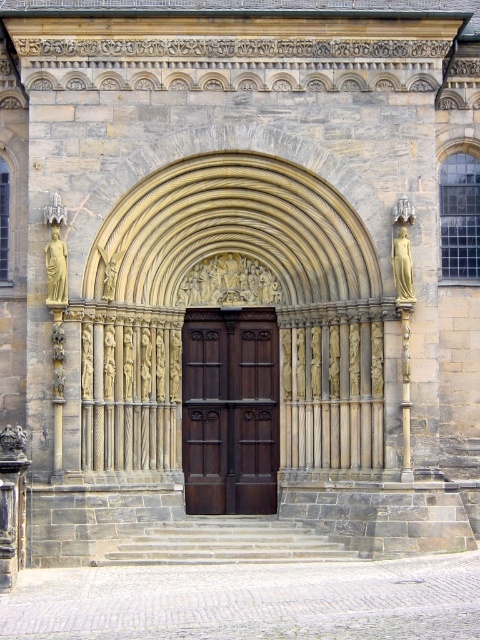
Question: Which point is closer to the camera taking this photo?

Choices:
 (A) (104, 275)
 (B) (191, 394)

Answer: (A)

Question: Is dark wood door at center to the right of golden stone statue at right from the viewer's perspective?

Choices:
 (A) yes
 (B) no

Answer: (B)

Question: Estimate the real-world distances between objects in this image. Which object is closer to the stone relief figures at center?

Choices:
 (A) golden stone statue at left
 (B) golden stone statue at center
 (C) dark wood door at center

Answer: (C)

Question: Does stone relief figures at center have a smaller size compared to golden stone statue at left?

Choices:
 (A) no
 (B) yes

Answer: (B)

Question: Which of these objects is positioned closest to the golden stone statue at right?

Choices:
 (A) golden stone statue at center
 (B) dark wood door at center
 (C) stone relief figures at center

Answer: (C)

Question: Is golden stone statue at left wider than golden stone statue at center?

Choices:
 (A) yes
 (B) no

Answer: (B)